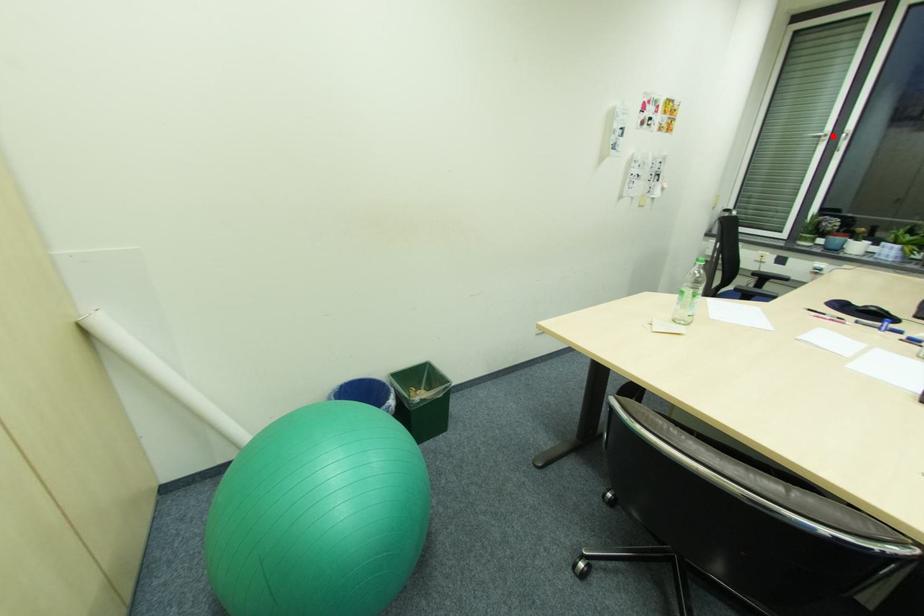
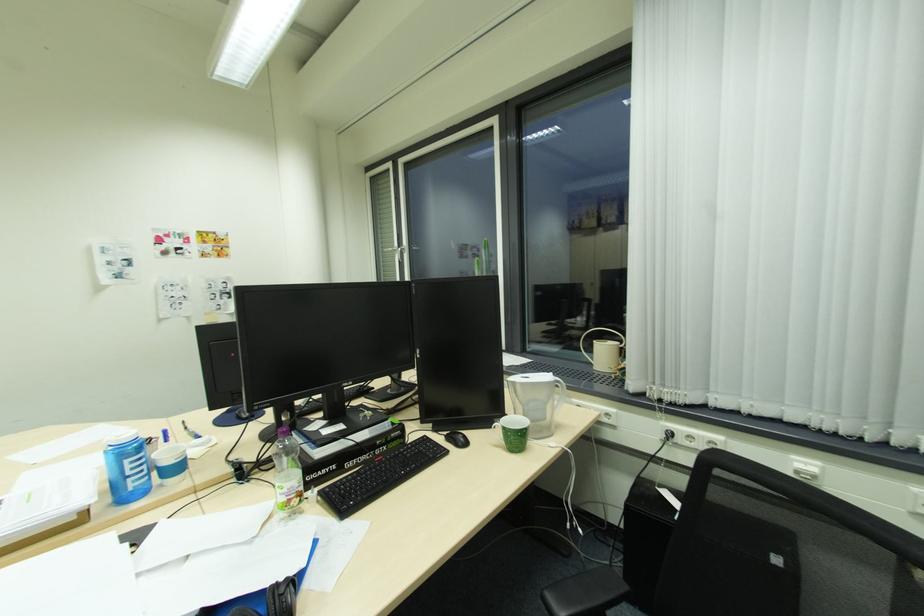
Question: I am providing you with two images of the same scene from different viewpoints. Image1 has a red point marked. In image2, the corresponding 3D location appears at what relative position? Reply with the corresponding letter.

Choices:
 (A) Closer
 (B) Farther

Answer: (A)